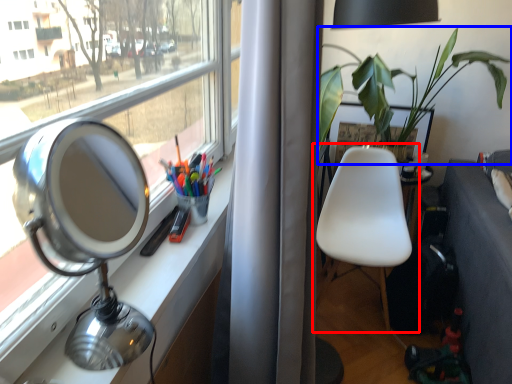
Question: Among these objects, which one is farthest to the camera, chair (highlighted by a red box) or houseplant (highlighted by a blue box)?

Choices:
 (A) chair
 (B) houseplant

Answer: (A)